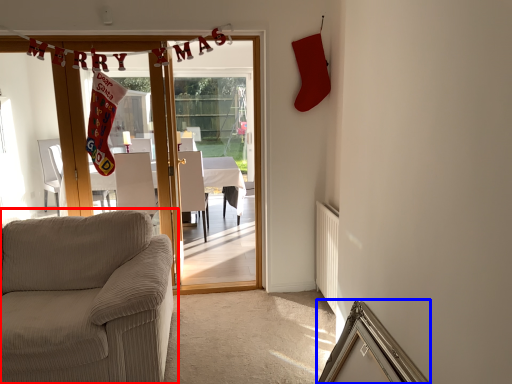
Question: Which of the following is the farthest to the observer, studio couch (highlighted by a red box) or picture frame (highlighted by a blue box)?

Choices:
 (A) studio couch
 (B) picture frame

Answer: (A)